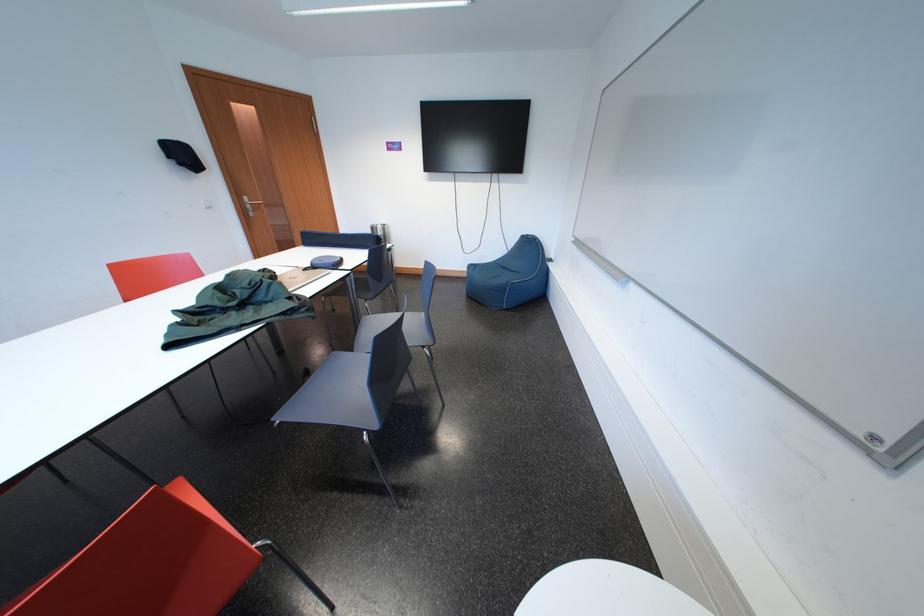
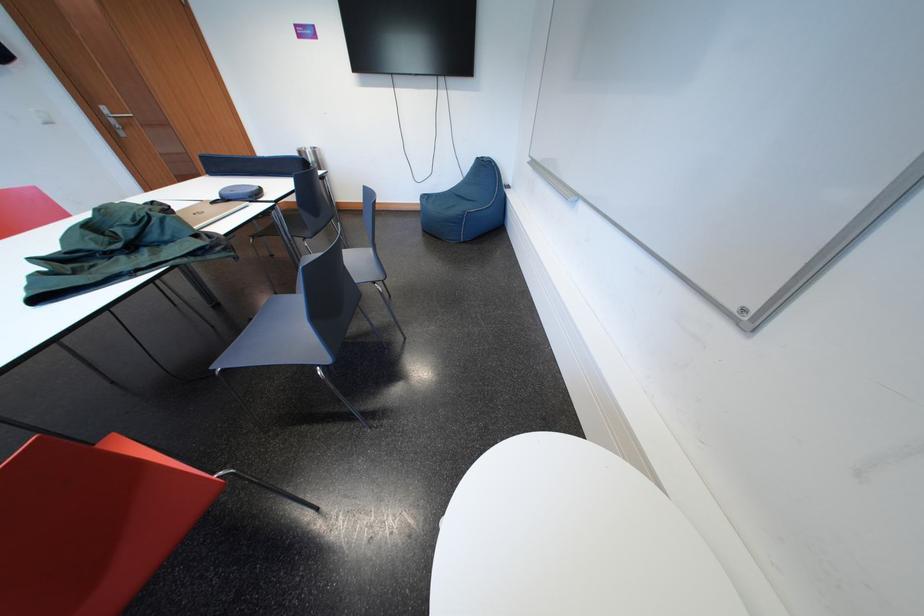
In the second image, find the point that corresponds to (358,280) in the first image.

(283, 213)